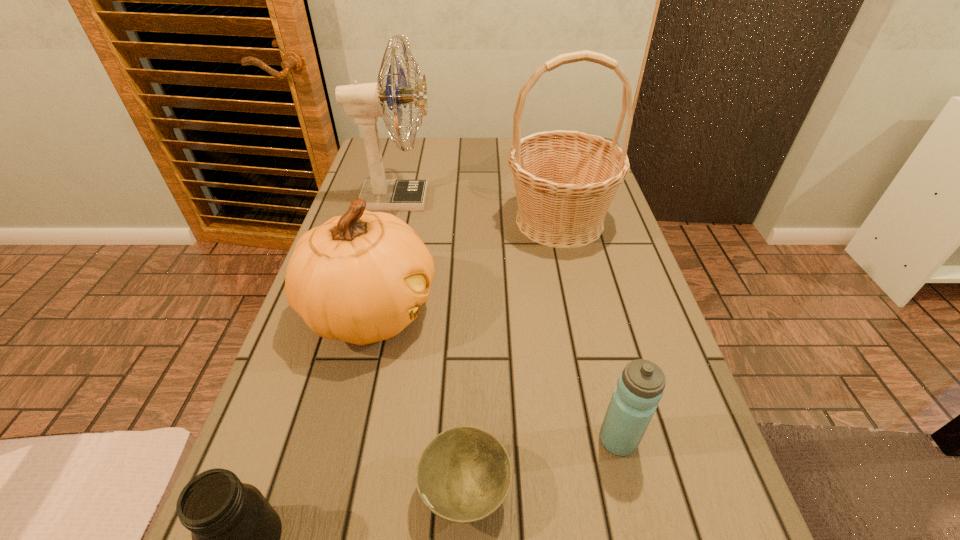
The height and width of the screenshot is (540, 960). Identify the location of vacant space that is in between the third tallest object and the water bottle. (494, 376).

Locate an element on the screen. free space between the pumpkin and the basket is located at coordinates (465, 266).

Locate an element on the screen. free space between the basket and the pumpkin is located at coordinates (465, 266).

Choose which object is the third nearest neighbor to the third shortest object. Please provide its 2D coordinates. Your answer should be formatted as a tuple, i.e. [(x, y)], where the tuple contains the x and y coordinates of a point satisfying the conditions above.

[(565, 181)]

Locate which object ranks second in proximity to the fan. Please provide its 2D coordinates. Your answer should be formatted as a tuple, i.e. [(x, y)], where the tuple contains the x and y coordinates of a point satisfying the conditions above.

[(565, 181)]

The image size is (960, 540). What are the coordinates of `free location that satisfies the following two spatial constraints: 1. on the front-facing side of the fan; 2. on the right side of the fourth tallest object` in the screenshot? It's located at (337, 440).

This screenshot has height=540, width=960. In order to click on vacant area in the image that satisfies the following two spatial constraints: 1. on the front face of the pumpkin; 2. on the left side of the water bottle in this screenshot , I will do `click(339, 440)`.